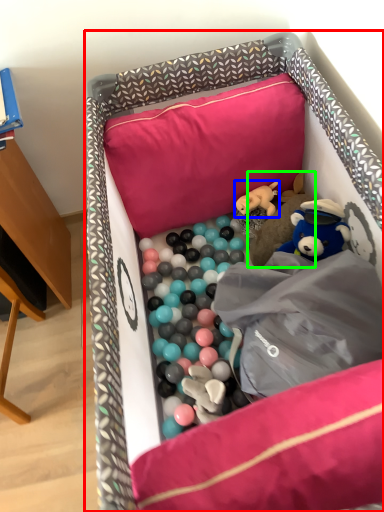
Question: Which is nearer to the infant bed (highlighted by a red box)? toy (highlighted by a blue box) or toy (highlighted by a green box).

Choices:
 (A) toy
 (B) toy

Answer: (B)